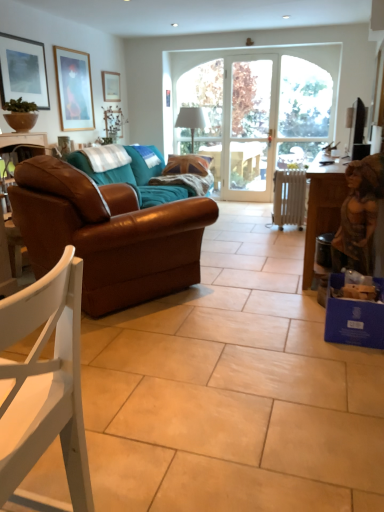
Locate an element on the screen. free location in front of blue cardboard box at lower right is located at coordinates (350, 355).